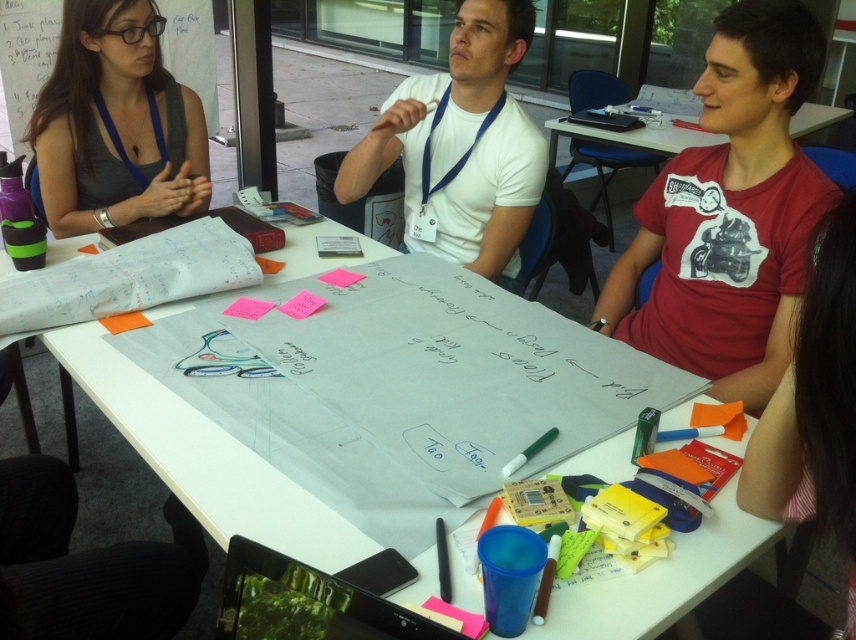
Does black fabric chair at lower left have a greater height compared to matte white paper at upper left?

No, black fabric chair at lower left is not taller than matte white paper at upper left.

Does black fabric chair at lower left appear over matte white paper at upper left?

No, black fabric chair at lower left is not above matte white paper at upper left.

What are the coordinates of `black fabric chair at lower left` in the screenshot? It's located at (86, 564).

Between white smooth t-shirt at center and matte plastic table at center, which one has less height?

matte plastic table at center

Between point (408, 145) and point (622, 172), which one is positioned in front?

Point (408, 145) is in front.

I want to click on white smooth t-shirt at center, so click(461, 147).

Where is `white smooth t-shirt at center`? The width and height of the screenshot is (856, 640). white smooth t-shirt at center is located at coordinates (461, 147).

Looking at this image, can you confirm if white paper at center is positioned to the left of matte plastic table at center?

Correct, you'll find white paper at center to the left of matte plastic table at center.

Who is positioned more to the right, white paper at center or matte plastic table at center?

From the viewer's perspective, matte plastic table at center appears more on the right side.

Describe the element at coordinates (205, 458) in the screenshot. I see `white paper at center` at that location.

You are a GUI agent. You are given a task and a screenshot of the screen. Output one action in this format:
    pyautogui.click(x=<x>, y=<y>)
    Task: Click on the white paper at center
    This screenshot has height=640, width=856.
    Given the screenshot: What is the action you would take?
    pyautogui.click(x=205, y=458)